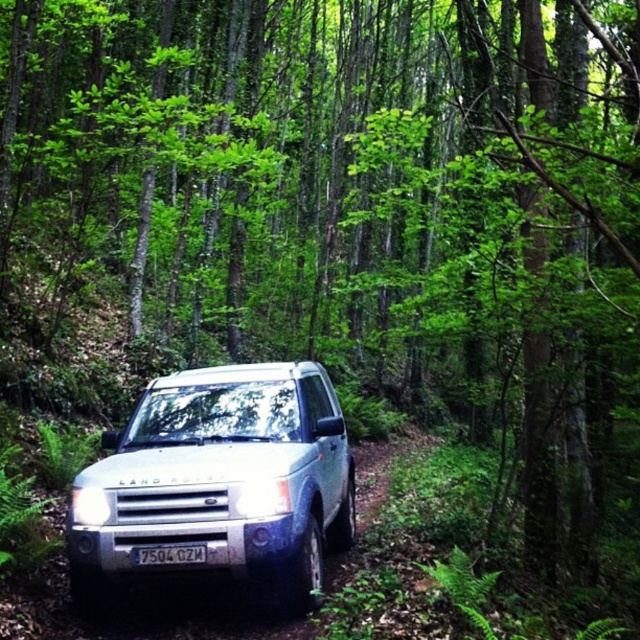
You are a photographer trying to capture the silver metallic suv at center and the white plastic license plate at center in a single shot. Based on their positions, which object will appear larger in your photo?

The silver metallic suv at center will appear larger in the photo because it is closer to the viewer than the white plastic license plate at center.

You are a delivery drone that needs to fly over the silver metallic suv at center and the white plastic license plate at center. Which object should you avoid flying too close to due to its size?

You should avoid flying too close to the silver metallic suv at center because it is larger in size than the white plastic license plate at center.

You are a delivery robot with a height of 1.5 meters. You need to pass through the narrow dirt path where the silver metallic suv at center and the white plastic license plate at center are located. Can you safely navigate through this path without hitting your head?

The silver metallic suv at center and white plastic license plate at center are 83.36 centimeters apart from each other. Since the robot is 1.5 meters tall, which is taller than the space between them, it cannot safely navigate through without hitting its head.